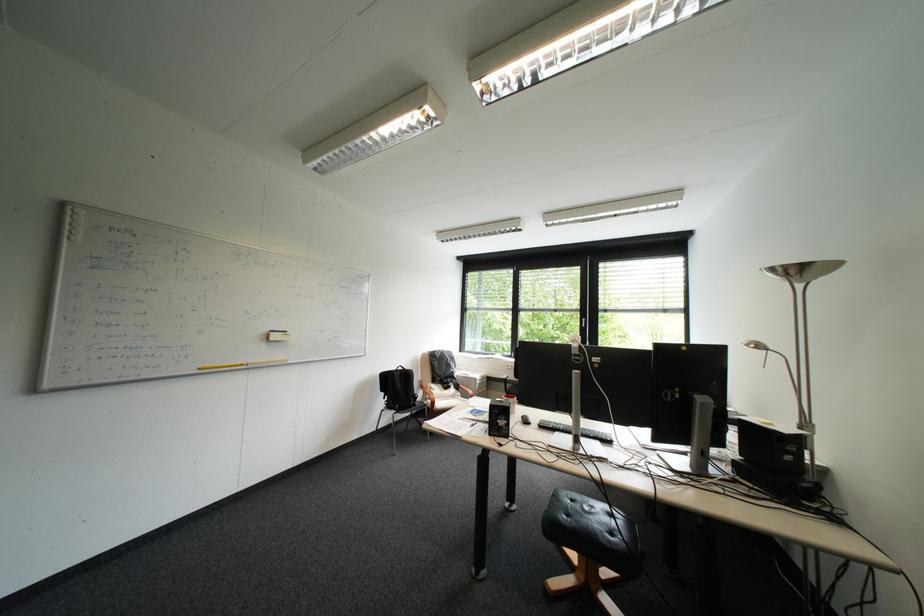
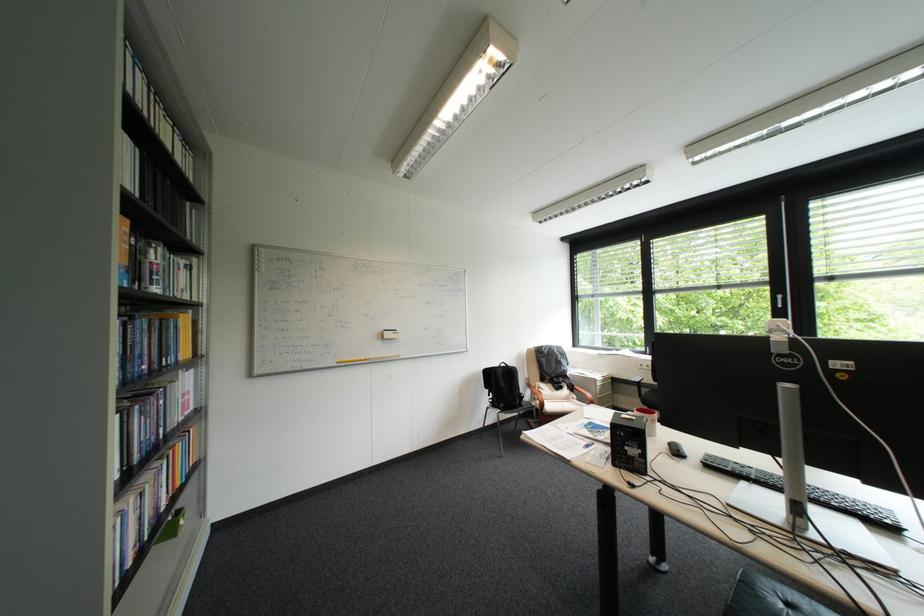
Find the pixel in the second image that matches pixel 590 318 in the first image.

(781, 294)